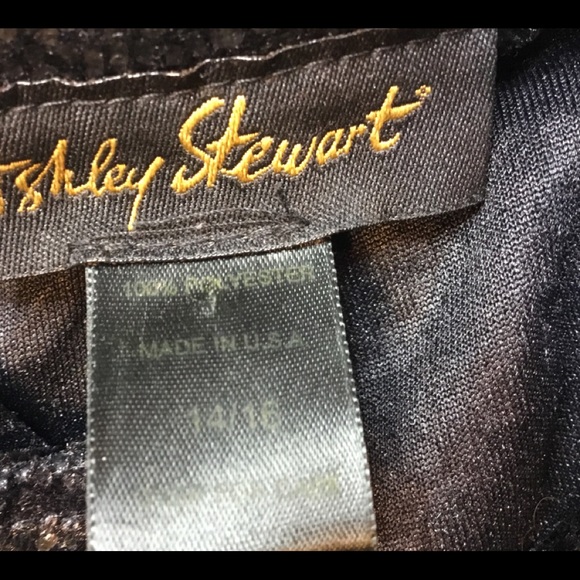
Locate an element on the screen. Image resolution: width=580 pixels, height=580 pixels. fabric is located at coordinates (258, 408), (139, 135), (467, 387).